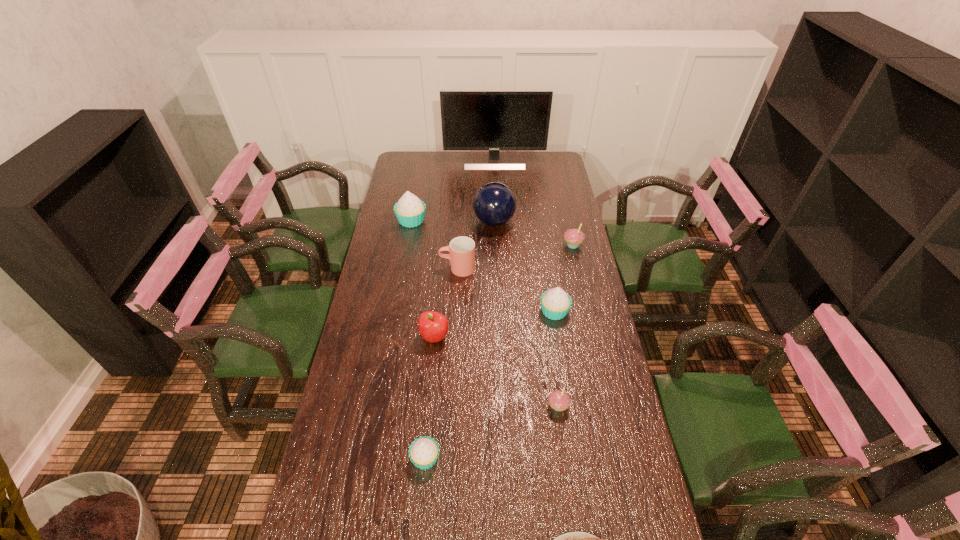
Where is `vacant space located 0.310m on the surface of the ninth shortest object near the finger holes`? The width and height of the screenshot is (960, 540). vacant space located 0.310m on the surface of the ninth shortest object near the finger holes is located at coordinates [402, 222].

Where is `free spot located on the back of the farthest cupcake`? The width and height of the screenshot is (960, 540). free spot located on the back of the farthest cupcake is located at coordinates (420, 176).

The image size is (960, 540). I want to click on free space located on the side of the cup with the handle, so click(396, 268).

The width and height of the screenshot is (960, 540). Identify the location of free location located on the side of the cup with the handle. (398, 268).

I want to click on free space located on the side of the cup with the handle, so click(x=394, y=268).

Where is `vacant space located 0.150m on the front of the rightmost cupcake`? vacant space located 0.150m on the front of the rightmost cupcake is located at coordinates (580, 279).

Where is `free space located 0.180m on the front of the second farthest white cupcake`? free space located 0.180m on the front of the second farthest white cupcake is located at coordinates (564, 368).

This screenshot has width=960, height=540. I want to click on vacant space situated 0.380m on the back of the apple, so click(x=443, y=253).

Locate an element on the screen. This screenshot has height=540, width=960. vacant space located on the back of the fourth cupcake from right to left is located at coordinates (433, 367).

Where is `free location located 0.080m on the front of the eighth farthest object`? free location located 0.080m on the front of the eighth farthest object is located at coordinates (563, 443).